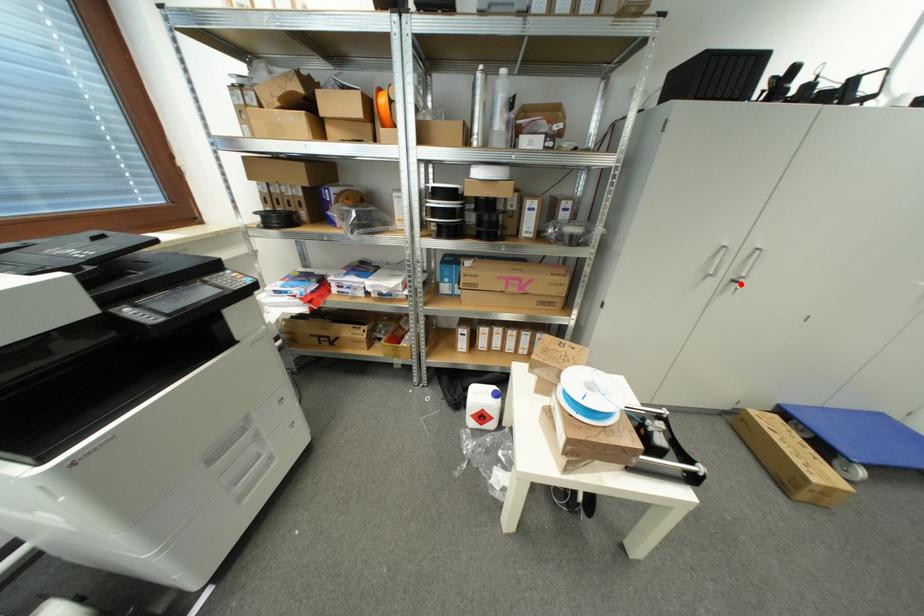
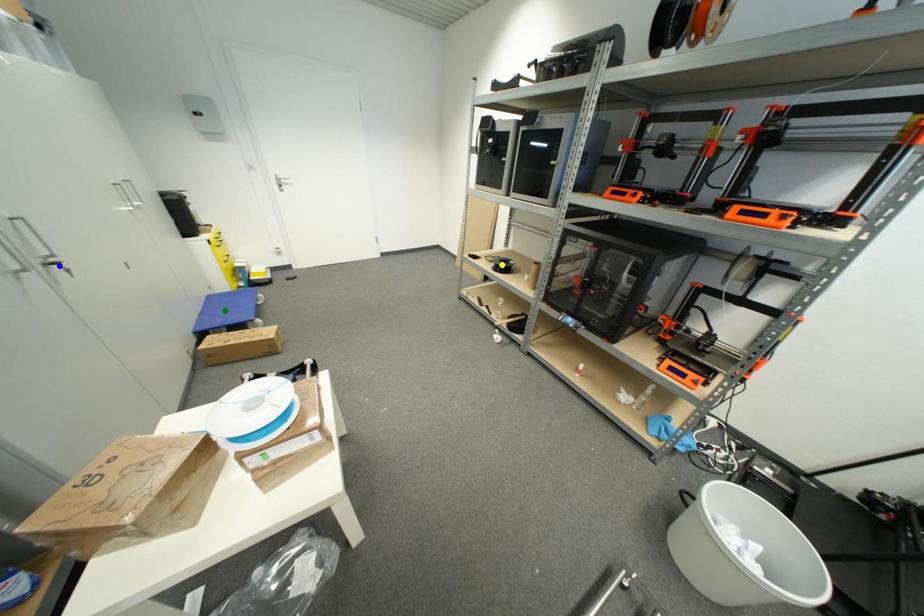
Question: I am providing you with two images of the same scene from different viewpoints. A red point is marked on the first image. You are given multiple points on the second image. Which point in image 2 is actually the same real-world point as the red point in image 1?

Choices:
 (A) green point
 (B) yellow point
 (C) blue point

Answer: (C)